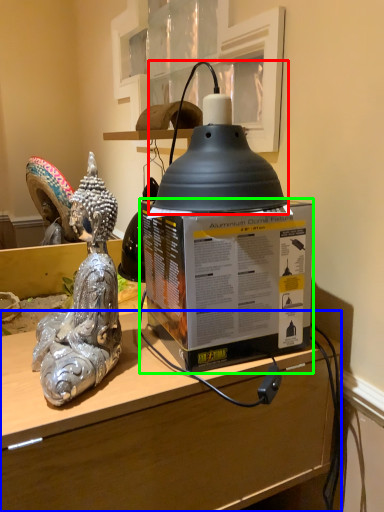
Question: Which is farther away from oil lamp (highlighted by a red box)? desk (highlighted by a blue box) or box (highlighted by a green box)?

Choices:
 (A) desk
 (B) box

Answer: (A)